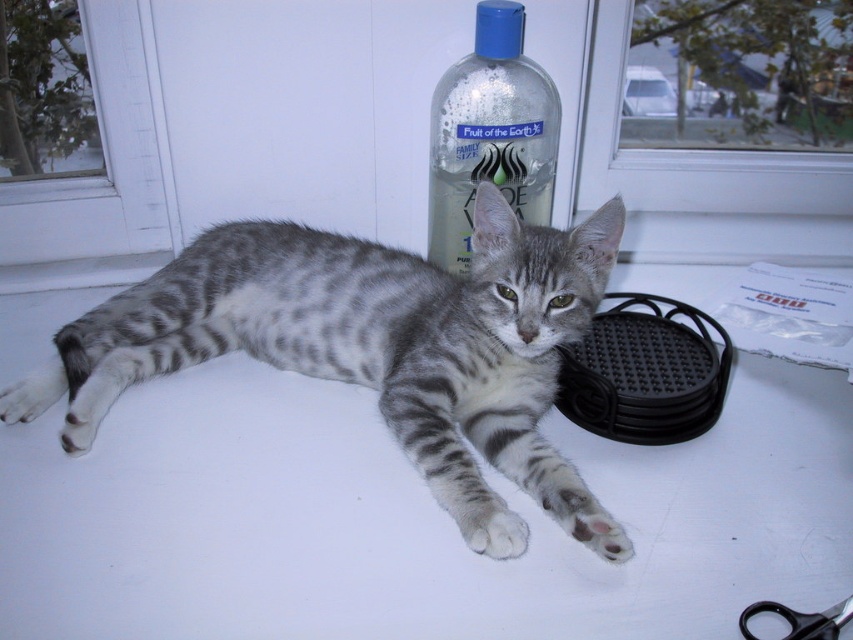
Question: Can you confirm if white plastic window at upper left is thinner than transparent glass window at upper left?

Choices:
 (A) yes
 (B) no

Answer: (B)

Question: Is clear plastic bottle at upper center bigger than black plastic scissors at lower right?

Choices:
 (A) yes
 (B) no

Answer: (A)

Question: Among these objects, which one is nearest to the camera?

Choices:
 (A) transparent glass window at upper center
 (B) transparent glass window at upper left
 (C) white plastic window at upper left

Answer: (C)

Question: Which of these objects is positioned farthest from the transparent glass window at upper left?

Choices:
 (A) black plastic scissors at lower right
 (B) transparent glass window at upper center
 (C) clear plastic bottle at upper center
 (D) white plastic window at upper left

Answer: (A)

Question: Which object appears closest to the camera in this image?

Choices:
 (A) transparent glass window at upper left
 (B) transparent glass window at upper center
 (C) white plastic window at upper left

Answer: (C)

Question: From the image, what is the correct spatial relationship of transparent glass window at upper center in relation to black plastic scissors at lower right?

Choices:
 (A) left
 (B) right

Answer: (B)